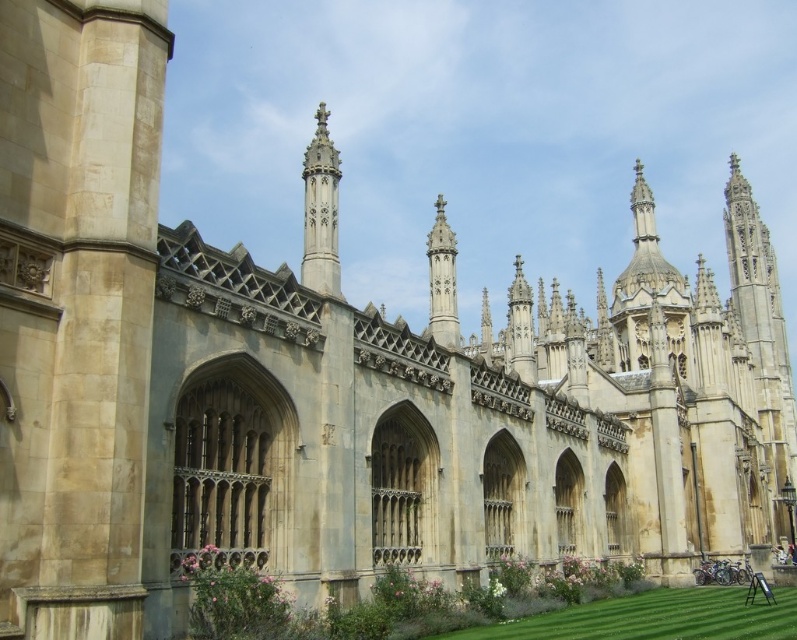
Question: Where is white stone spire at upper center located in relation to polished stone spire at center in the image?

Choices:
 (A) right
 (B) left

Answer: (B)

Question: Estimate the real-world distances between objects in this image. Which object is farther from the stone gothic tower at center?

Choices:
 (A) polished stone spire at center
 (B) green lawn at lower center
 (C) white stone spire at upper center

Answer: (C)

Question: Estimate the real-world distances between objects in this image. Which object is farther from the green lawn at lower center?

Choices:
 (A) white stone spire at upper center
 (B) polished stone spire at center
 (C) stone gothic tower at center

Answer: (C)

Question: Can you confirm if white stone spire at upper center is positioned above polished stone spire at center?

Choices:
 (A) no
 (B) yes

Answer: (B)

Question: Can you confirm if green lawn at lower center is smaller than polished stone spire at center?

Choices:
 (A) yes
 (B) no

Answer: (B)

Question: Considering the real-world distances, which object is farthest from the stone gothic tower at center?

Choices:
 (A) white stone spire at upper center
 (B) green lawn at lower center

Answer: (A)